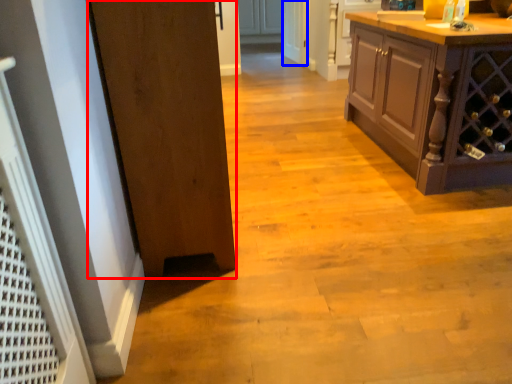
Question: Which object is closer to the camera taking this photo, door (highlighted by a red box) or screen door (highlighted by a blue box)?

Choices:
 (A) door
 (B) screen door

Answer: (A)